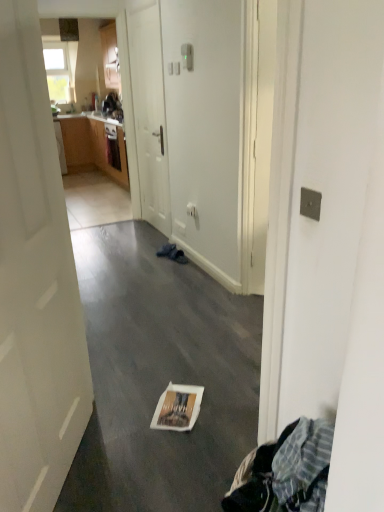
Locate an element on the screen. Image resolution: width=384 pixels, height=512 pixels. vacant space behind white glossy magazine at center is located at coordinates (171, 370).